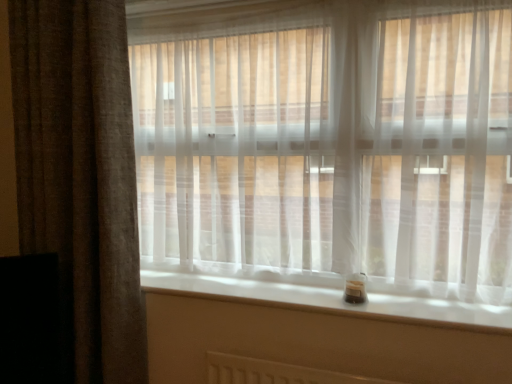
Describe the element at coordinates (333, 299) in the screenshot. The height and width of the screenshot is (384, 512). I see `white smooth window sill at lower center` at that location.

What is the approximate width of brown textured curtain at left, arranged as the 2th curtain when viewed from the right?

8.10 inches.

What are the coordinates of `white smooth window sill at lower center` in the screenshot? It's located at (333, 299).

Considering the sizes of objects white smooth window sill at lower center and translucent white curtain at center, arranged as the second curtain when viewed from the left, in the image provided, who is taller, white smooth window sill at lower center or translucent white curtain at center, arranged as the second curtain when viewed from the left,?

translucent white curtain at center, arranged as the second curtain when viewed from the left.

Considering the points (486, 304) and (278, 15), which point is behind, point (486, 304) or point (278, 15)?

Point (278, 15)

This screenshot has width=512, height=384. Find the location of `curtain that is the 2nd one above the white smooth window sill at lower center (from a real-world perspective)`. curtain that is the 2nd one above the white smooth window sill at lower center (from a real-world perspective) is located at coordinates (327, 142).

Could white smooth window sill at lower center be considered to be inside translucent white curtain at center, placed as the 1th curtain when sorted from right to left?

No, translucent white curtain at center, placed as the 1th curtain when sorted from right to left, does not contain white smooth window sill at lower center.

Between point (263, 218) and point (440, 307), which one is positioned behind?

The point (263, 218) is farther from the camera.

Between translucent white curtain at center, arranged as the second curtain when viewed from the left, and white smooth window sill at lower center, which one is positioned in front?

white smooth window sill at lower center is in front.

Is translucent white curtain at center, arranged as the second curtain when viewed from the left, shorter than white smooth window sill at lower center?

No, translucent white curtain at center, arranged as the second curtain when viewed from the left, is not shorter than white smooth window sill at lower center.

Find the location of a particular element. curtain on the right of brown textured curtain at left, acting as the 1th curtain starting from the left is located at coordinates (327, 142).

Are translucent white curtain at center, arranged as the second curtain when viewed from the left, and brown textured curtain at left, acting as the 1th curtain starting from the left, located far from each other?

That's not correct — translucent white curtain at center, arranged as the second curtain when viewed from the left, is a little close to brown textured curtain at left, acting as the 1th curtain starting from the left.

Can you tell me how much translucent white curtain at center, arranged as the second curtain when viewed from the left, and brown textured curtain at left, arranged as the 2th curtain when viewed from the right, differ in facing direction?

The angular difference between translucent white curtain at center, arranged as the second curtain when viewed from the left, and brown textured curtain at left, arranged as the 2th curtain when viewed from the right, is 3.43 degrees.

Considering the positions of objects translucent white curtain at center, placed as the 1th curtain when sorted from right to left, and brown textured curtain at left, arranged as the 2th curtain when viewed from the right, in the image provided, who is in front, translucent white curtain at center, placed as the 1th curtain when sorted from right to left, or brown textured curtain at left, arranged as the 2th curtain when viewed from the right,?

Positioned in front is translucent white curtain at center, placed as the 1th curtain when sorted from right to left.

Is translucent white curtain at center, placed as the 1th curtain when sorted from right to left, inside brown textured curtain at left, acting as the 1th curtain starting from the left?

That's incorrect, translucent white curtain at center, placed as the 1th curtain when sorted from right to left, is not inside brown textured curtain at left, acting as the 1th curtain starting from the left.

Considering the positions of objects brown textured curtain at left, acting as the 1th curtain starting from the left, and translucent white curtain at center, arranged as the second curtain when viewed from the left, in the image provided, who is more to the right, brown textured curtain at left, acting as the 1th curtain starting from the left, or translucent white curtain at center, arranged as the second curtain when viewed from the left,?

translucent white curtain at center, arranged as the second curtain when viewed from the left, is more to the right.

Is point (104, 380) behind point (428, 239)?

Yes.

From the picture: Relative to translucent white curtain at center, arranged as the second curtain when viewed from the left, is brown textured curtain at left, acting as the 1th curtain starting from the left, in front or behind?

Clearly, brown textured curtain at left, acting as the 1th curtain starting from the left, is behind translucent white curtain at center, arranged as the second curtain when viewed from the left.

Which curtain is the 2nd one when counting from the left side of the white smooth window sill at lower center? Please provide its 2D coordinates.

[(81, 175)]

Is white smooth window sill at lower center not within brown textured curtain at left, acting as the 1th curtain starting from the left?

Yes, white smooth window sill at lower center is located beyond the bounds of brown textured curtain at left, acting as the 1th curtain starting from the left.

From the image's perspective, between white smooth window sill at lower center and brown textured curtain at left, acting as the 1th curtain starting from the left, which one is located above?

brown textured curtain at left, acting as the 1th curtain starting from the left, is shown above in the image.

Measure the distance from brown textured curtain at left, arranged as the 2th curtain when viewed from the right, to white smooth window sill at lower center.

22.43 inches.

Is brown textured curtain at left, arranged as the 2th curtain when viewed from the right, inside or outside of white smooth window sill at lower center?

brown textured curtain at left, arranged as the 2th curtain when viewed from the right, cannot be found inside white smooth window sill at lower center.

Are brown textured curtain at left, arranged as the 2th curtain when viewed from the right, and white smooth window sill at lower center located far from each other?

brown textured curtain at left, arranged as the 2th curtain when viewed from the right, is actually quite close to white smooth window sill at lower center.

Where is `the 2nd curtain to the left when counting from the white smooth window sill at lower center`? Image resolution: width=512 pixels, height=384 pixels. the 2nd curtain to the left when counting from the white smooth window sill at lower center is located at coordinates (81, 175).

I want to click on the 2nd curtain above the white smooth window sill at lower center (from the image's perspective), so click(327, 142).

You are a GUI agent. You are given a task and a screenshot of the screen. Output one action in this format:
    pyautogui.click(x=<x>, y=<y>)
    Task: Click on the 2nd curtain positioned above the white smooth window sill at lower center (from a real-world perspective)
    
    Given the screenshot: What is the action you would take?
    pyautogui.click(x=327, y=142)

From the image, which object appears to be farther from translucent white curtain at center, arranged as the second curtain when viewed from the left, white smooth window sill at lower center or brown textured curtain at left, acting as the 1th curtain starting from the left?

brown textured curtain at left, acting as the 1th curtain starting from the left, is further to translucent white curtain at center, arranged as the second curtain when viewed from the left.

From the image, which object appears to be farther from white smooth window sill at lower center, translucent white curtain at center, placed as the 1th curtain when sorted from right to left, or brown textured curtain at left, acting as the 1th curtain starting from the left?

brown textured curtain at left, acting as the 1th curtain starting from the left, is positioned further to the anchor white smooth window sill at lower center.

Looking at the image, which one is located closer to white smooth window sill at lower center, brown textured curtain at left, arranged as the 2th curtain when viewed from the right, or translucent white curtain at center, arranged as the second curtain when viewed from the left?

Based on the image, translucent white curtain at center, arranged as the second curtain when viewed from the left, appears to be nearer to white smooth window sill at lower center.

From the image, which object appears to be farther from brown textured curtain at left, arranged as the 2th curtain when viewed from the right, white smooth window sill at lower center or translucent white curtain at center, arranged as the second curtain when viewed from the left?

Among the two, white smooth window sill at lower center is located further to brown textured curtain at left, arranged as the 2th curtain when viewed from the right.

Looking at the image, which one is located further to brown textured curtain at left, acting as the 1th curtain starting from the left, translucent white curtain at center, placed as the 1th curtain when sorted from right to left, or white smooth window sill at lower center?

white smooth window sill at lower center.

When comparing their distances from translucent white curtain at center, arranged as the second curtain when viewed from the left, does brown textured curtain at left, arranged as the 2th curtain when viewed from the right, or white smooth window sill at lower center seem further?

brown textured curtain at left, arranged as the 2th curtain when viewed from the right, is positioned further to the anchor translucent white curtain at center, arranged as the second curtain when viewed from the left.

Where is `curtain situated between brown textured curtain at left, acting as the 1th curtain starting from the left, and white smooth window sill at lower center from left to right`? The image size is (512, 384). curtain situated between brown textured curtain at left, acting as the 1th curtain starting from the left, and white smooth window sill at lower center from left to right is located at coordinates (327, 142).